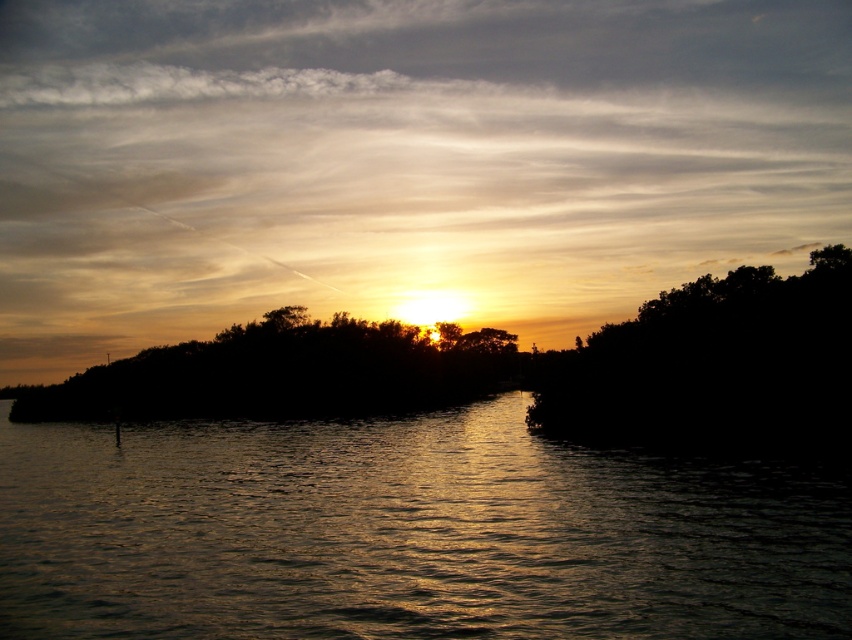
Question: Among these points, which one is farthest from the camera?

Choices:
 (A) [x=703, y=429]
 (B) [x=764, y=518]

Answer: (A)

Question: In this image, where is silvery reflective water at center located relative to silhouette leafy tree at right?

Choices:
 (A) left
 (B) right

Answer: (A)

Question: Is silvery reflective water at center positioned behind silhouette leafy tree at right?

Choices:
 (A) yes
 (B) no

Answer: (B)

Question: Observing the image, what is the correct spatial positioning of silvery reflective water at center in reference to silhouette leafy tree at right?

Choices:
 (A) below
 (B) above

Answer: (A)